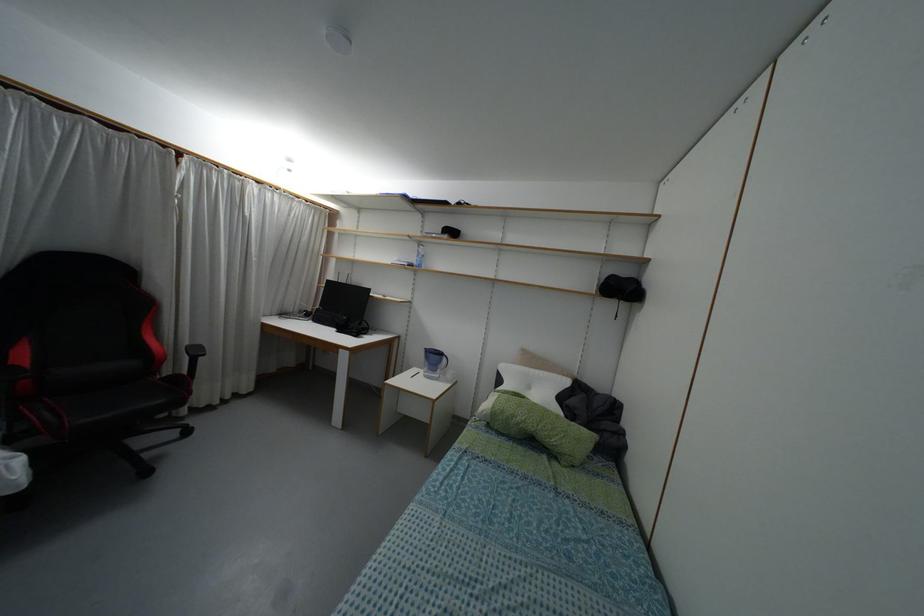
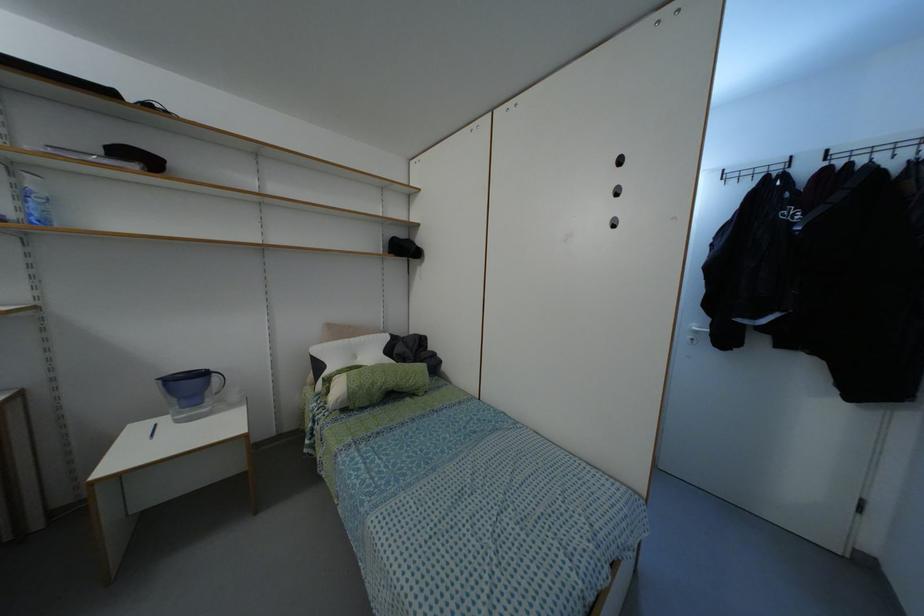
In the second image, find the point that corresponds to (419,265) in the first image.

(44, 222)